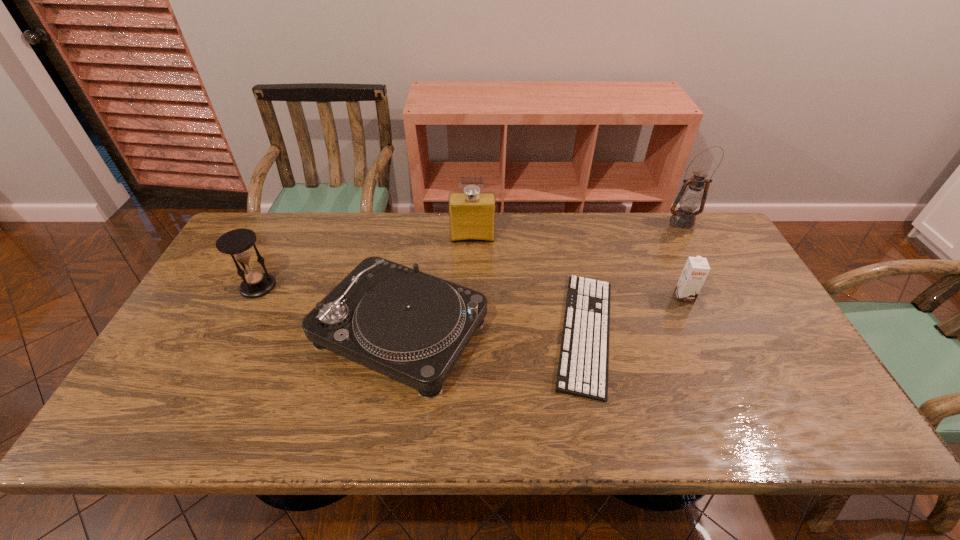
The width and height of the screenshot is (960, 540). What are the coordinates of `vacant space that is in between the chocolate milk and the record player` in the screenshot? It's located at (542, 314).

Find the location of a particular element. The height and width of the screenshot is (540, 960). empty location between the record player and the computer keyboard is located at coordinates (493, 332).

Select which object appears as the second closest to the record player. Please provide its 2D coordinates. Your answer should be formatted as a tuple, i.e. [(x, y)], where the tuple contains the x and y coordinates of a point satisfying the conditions above.

[(584, 355)]

Select which object appears as the third closest to the tallest object. Please provide its 2D coordinates. Your answer should be formatted as a tuple, i.e. [(x, y)], where the tuple contains the x and y coordinates of a point satisfying the conditions above.

[(472, 214)]

I want to click on blank space that satisfies the following two spatial constraints: 1. on the front-facing side of the shortest object; 2. on the right side of the fifth nearest object, so click(x=470, y=333).

Identify the location of vacant position in the image that satisfies the following two spatial constraints: 1. on the front side of the record player; 2. on the left side of the leftmost object. (235, 332).